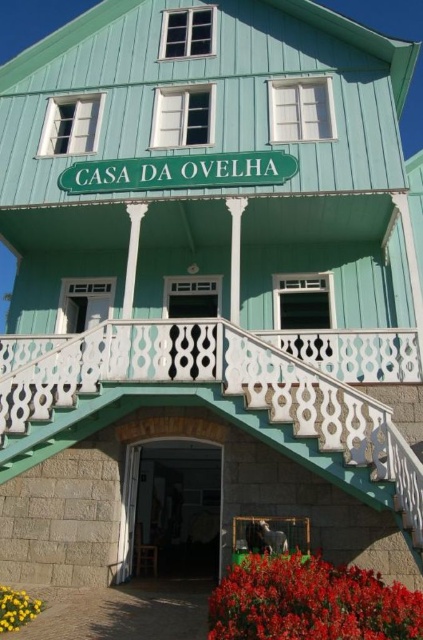
Question: Where is wooden door at center located in relation to yellow matte flower at lower left in the image?

Choices:
 (A) right
 (B) left

Answer: (A)

Question: Which object appears farthest from the camera in this image?

Choices:
 (A) vivid red petals at lower center
 (B) yellow matte flower at lower left

Answer: (B)

Question: Among these points, which one is farthest from the camera?

Choices:
 (A) [x=359, y=627]
 (B) [x=139, y=566]

Answer: (B)

Question: Is vivid red petals at lower center closer to the viewer compared to wooden door at center?

Choices:
 (A) yes
 (B) no

Answer: (A)

Question: Is vivid red petals at lower center wider than wooden door at center?

Choices:
 (A) yes
 (B) no

Answer: (A)

Question: Which is farther from the wooden door at center?

Choices:
 (A) vivid red petals at lower center
 (B) yellow matte flower at lower left

Answer: (B)